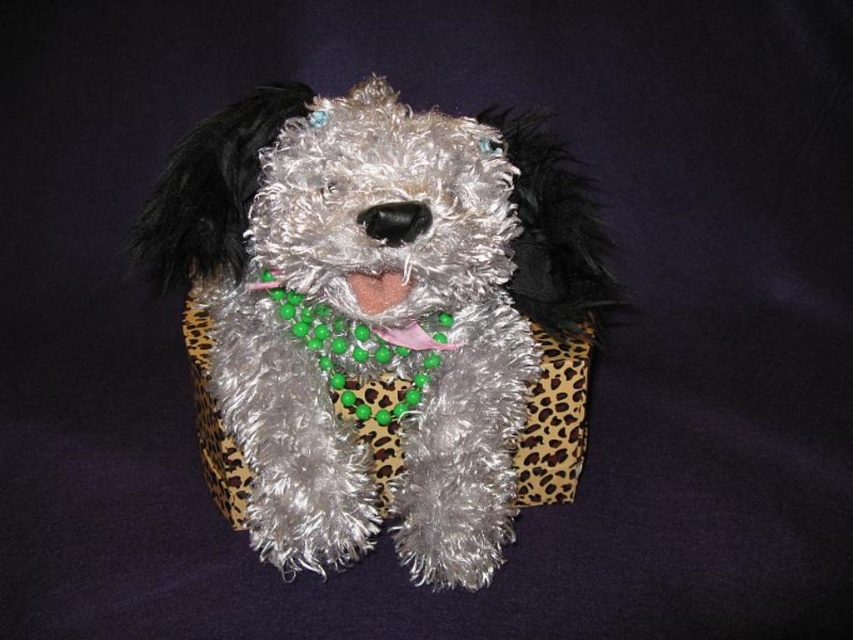
Does fuzzy silver dog at center have a lesser height compared to pink fabric at center?

No, fuzzy silver dog at center is not shorter than pink fabric at center.

Between point (305, 365) and point (393, 292), which one is positioned in front?

Point (393, 292) is more forward.

Find the location of a particular element. fuzzy silver dog at center is located at coordinates point(375,316).

Does fuzzy silver dog at center appear under green beaded necklace at center?

Correct, fuzzy silver dog at center is located below green beaded necklace at center.

Which is behind, point (428, 320) or point (386, 337)?

The point (428, 320) is behind.

Find the location of a particular element. fuzzy silver dog at center is located at coordinates (375, 316).

Which is below, green beaded necklace at center or pink fabric at center?

green beaded necklace at center is below.

Is green beaded necklace at center above pink fabric at center?

Incorrect, green beaded necklace at center is not positioned above pink fabric at center.

Between point (402, 285) and point (379, 282), which one is positioned in front?

Point (402, 285)

Locate an element on the screen. Image resolution: width=853 pixels, height=640 pixels. green beaded necklace at center is located at coordinates (378, 291).